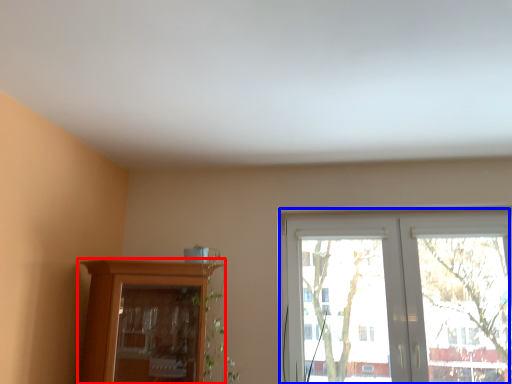
Question: Which object is closer to the camera taking this photo, cupboard (highlighted by a red box) or window (highlighted by a blue box)?

Choices:
 (A) cupboard
 (B) window

Answer: (A)